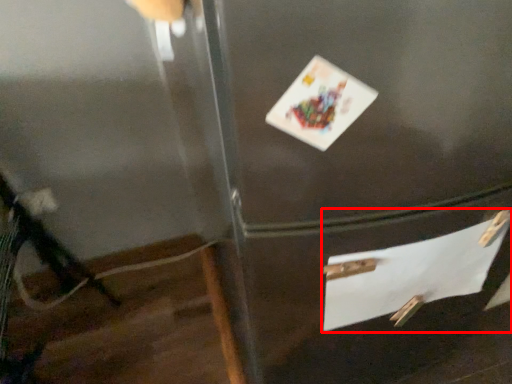
Question: Observing the image, what is the correct spatial positioning of drawer (annotated by the red box) in reference to postcard?

Choices:
 (A) right
 (B) left

Answer: (A)